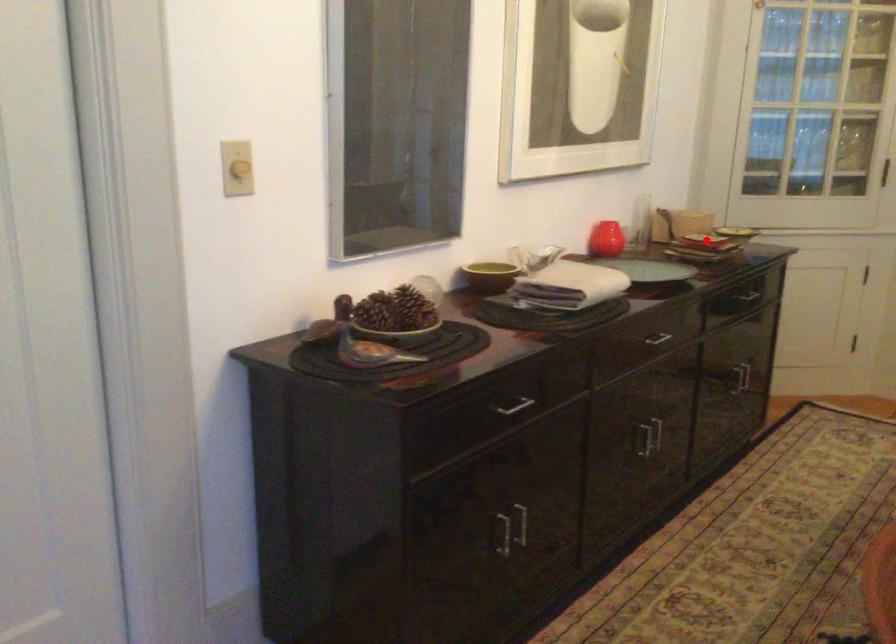
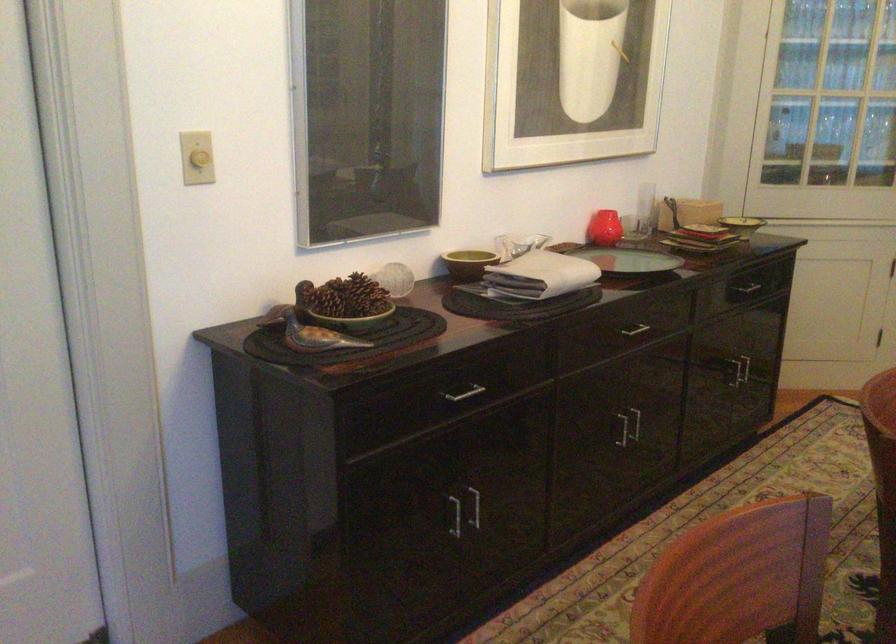
Locate, in the second image, the point that corresponds to the highlighted location in the first image.

(704, 230)